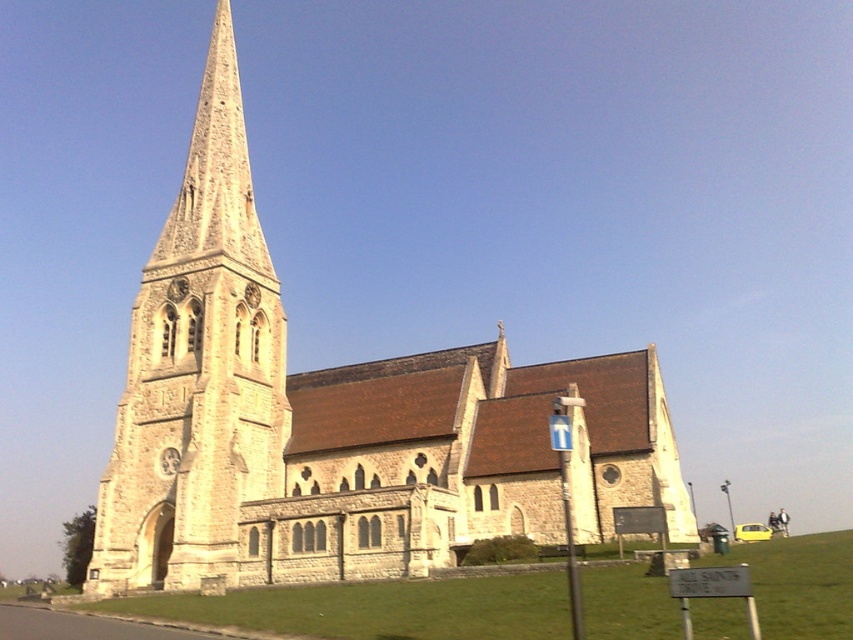
You are standing in front of the church and want to take a photo of both the light beige stone church at center and the stone steeple at center. Which one should you focus on first to ensure both are in sharp focus?

You should focus on the light beige stone church at center first because it is closer to you than the stone steeple at center, ensuring both will be in focus when focused on the closer object.

You are standing in front of the church and want to take a photo that includes both the light beige stone church at center and the stone steeple at center. Which object should you frame first in your camera to ensure both are fully visible?

Answer: You should frame the light beige stone church at center first because it has a larger size compared to the stone steeple at center, so ensuring it fits will naturally include the smaller steeple within the frame.

You are standing in front of the church and want to take a photo of the stone steeple at center and the light beige stone church at center. Which object should you frame first in your camera viewfinder to ensure both are fully visible?

You should frame the light beige stone church at center first because it is positioned on the right side of the stone steeple at center, so including the steeple first will allow space for the church to the right.